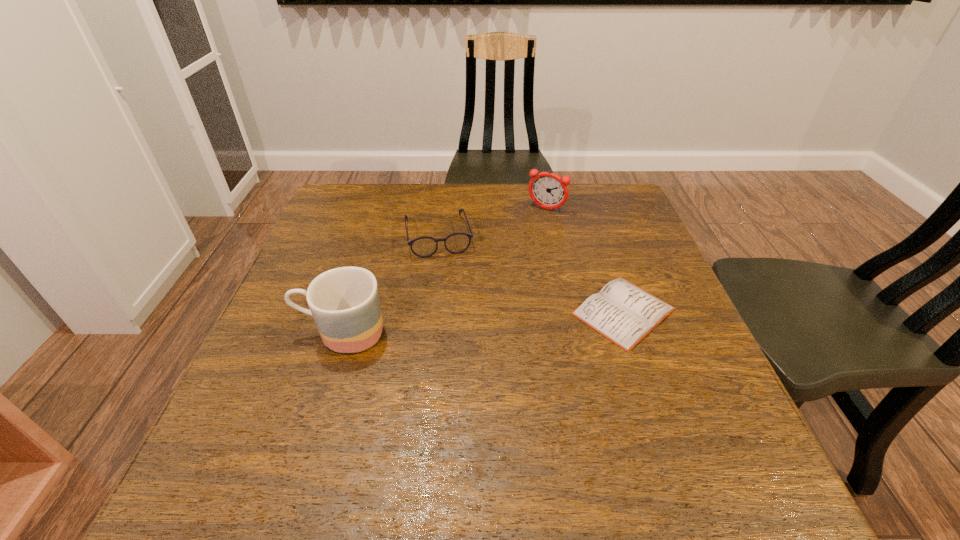
Identify the location of vacant point at the far left corner. Image resolution: width=960 pixels, height=540 pixels. (343, 192).

The width and height of the screenshot is (960, 540). Identify the location of vacant space at the far right corner. (593, 186).

In the image, there is a desktop. Identify the location of free space at the near right corner. (705, 441).

Locate an element on the screen. vacant area that lies between the alarm clock and the shortest object is located at coordinates [585, 260].

The width and height of the screenshot is (960, 540). In order to click on blank region between the spectacles and the alarm clock in this screenshot , I will do `click(492, 222)`.

Locate an element on the screen. This screenshot has height=540, width=960. vacant point located between the alarm clock and the mug is located at coordinates pyautogui.click(x=444, y=271).

Find the location of a particular element. vacant space in between the diary and the alarm clock is located at coordinates (585, 260).

I want to click on free space between the mug and the shortest object, so click(483, 322).

This screenshot has width=960, height=540. Identify the location of empty space between the mug and the third tallest object. (390, 284).

Where is `vacant area between the diary and the alarm clock`? The image size is (960, 540). vacant area between the diary and the alarm clock is located at coordinates (585, 260).